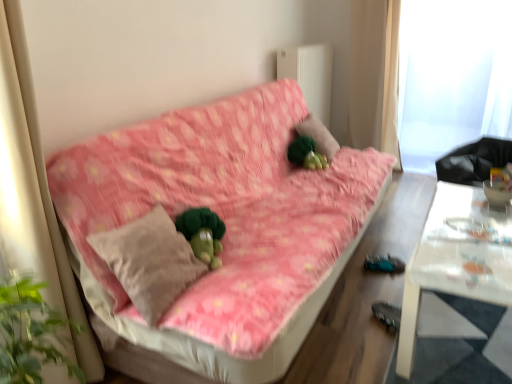
You are a GUI agent. You are given a task and a screenshot of the screen. Output one action in this format:
    pyautogui.click(x=<x>, y=<y>)
    Task: Click on the white glossy table at right
    
    Given the screenshot: What is the action you would take?
    pyautogui.click(x=457, y=258)

The image size is (512, 384). What do you see at coordinates (306, 154) in the screenshot? I see `green plush toy at center` at bounding box center [306, 154].

Describe the element at coordinates (319, 135) in the screenshot. The height and width of the screenshot is (384, 512). I see `green plush at center` at that location.

Where is `beige fabric pillow at center`? This screenshot has height=384, width=512. beige fabric pillow at center is located at coordinates (149, 261).

Find the location of a particular element. white glossy table at right is located at coordinates (457, 258).

Between pink floral fabric couch at center and white fabric curtain at upper right, which one has larger size?

pink floral fabric couch at center.

What's the angular difference between pink floral fabric couch at center and white fabric curtain at upper right's facing directions?

90 degrees separate the facing orientations of pink floral fabric couch at center and white fabric curtain at upper right.

Is pink floral fabric couch at center wider or thinner than white fabric curtain at upper right?

In the image, pink floral fabric couch at center appears to be wider than white fabric curtain at upper right.

Consider the image. Can we say pink floral fabric couch at center lies outside white fabric curtain at upper right?

pink floral fabric couch at center lies outside white fabric curtain at upper right's area.

Considering the relative sizes of green plush at center and white fabric curtain at upper right in the image provided, is green plush at center thinner than white fabric curtain at upper right?

Correct, the width of green plush at center is less than that of white fabric curtain at upper right.

In the scene shown: Would you say green plush at center is a long distance from white fabric curtain at upper right?

They are positioned close to each other.

Between green plush at center and white fabric curtain at upper right, which one has larger size?

Bigger between the two is white fabric curtain at upper right.

Is point (321, 191) closer or farther from the camera than point (316, 140)?

Point (321, 191).

Is green plush at center located within pink floral fabric couch at center?

Indeed, green plush at center is located within pink floral fabric couch at center.

Who is shorter, pink floral fabric couch at center or green plush at center?

With less height is green plush at center.

From the image's perspective, does pink floral fabric couch at center appear higher than green plush at center?

No, from the image's perspective, pink floral fabric couch at center is not on top of green plush at center.

Can you confirm if white glossy table at right is positioned to the right of beige fabric pillow at center?

Yes, white glossy table at right is to the right of beige fabric pillow at center.

From the image's perspective, would you say white glossy table at right is positioned over beige fabric pillow at center?

No.

What's the angular difference between white glossy table at right and beige fabric pillow at center's facing directions?

The angular difference between white glossy table at right and beige fabric pillow at center is 90 degrees.

Are white glossy table at right and beige fabric pillow at center making contact?

There is a gap between white glossy table at right and beige fabric pillow at center.

Is green plush at center positioned with its back to transparent plastic window screen at upper right?

That's not correct — green plush at center is not looking away from transparent plastic window screen at upper right.

From the image's perspective, is green plush at center above transparent plastic window screen at upper right?

No.

Considering the relative sizes of green plush at center and transparent plastic window screen at upper right in the image provided, is green plush at center smaller than transparent plastic window screen at upper right?

Correct, green plush at center occupies less space than transparent plastic window screen at upper right.

Considering the positions of objects green plush at center and transparent plastic window screen at upper right in the image provided, who is more to the right, green plush at center or transparent plastic window screen at upper right?

Positioned to the right is transparent plastic window screen at upper right.

Is green plush toy at center completely or partially inside white fabric curtain at upper right?

That's incorrect, green plush toy at center is not inside white fabric curtain at upper right.

Locate an element on the screen. This screenshot has height=384, width=512. toy in front of the white fabric curtain at upper right is located at coordinates (306, 154).

Which object is positioned more to the left, white fabric curtain at upper right or green plush toy at center?

green plush toy at center is more to the left.

Considering the sizes of objects white glossy table at right and transparent plastic window screen at upper right in the image provided, who is taller, white glossy table at right or transparent plastic window screen at upper right?

With more height is transparent plastic window screen at upper right.

Is white glossy table at right not near transparent plastic window screen at upper right?

Yes.

Which of these two, white glossy table at right or transparent plastic window screen at upper right, is thinner?

With smaller width is transparent plastic window screen at upper right.

Is point (473, 246) positioned behind point (406, 41)?

No, (473, 246) is closer to viewer.

Identify the location of curtain above the pink floral fabric couch at center (from the image's perspective). The height and width of the screenshot is (384, 512). (375, 75).

Where is `curtain to the right of green plush at center`? This screenshot has width=512, height=384. curtain to the right of green plush at center is located at coordinates (375, 75).

Considering their positions, is white glossy table at right positioned further to pink floral fabric couch at center than transparent plastic window screen at upper right?

The object further to pink floral fabric couch at center is transparent plastic window screen at upper right.

Looking at the image, which one is located further to white fabric curtain at upper right, transparent plastic window screen at upper right or pink floral fabric couch at center?

The object further to white fabric curtain at upper right is pink floral fabric couch at center.

Estimate the real-world distances between objects in this image. Which object is closer to white fabric curtain at upper right, white glossy table at right or green plush toy at center?

green plush toy at center is closer to white fabric curtain at upper right.

Looking at the image, which one is located closer to green plush at center, transparent plastic window screen at upper right or white fabric curtain at upper right?

The object closer to green plush at center is white fabric curtain at upper right.

Which object lies nearer to the anchor point white fabric curtain at upper right, beige fabric pillow at center or white glossy table at right?

Among the two, white glossy table at right is located nearer to white fabric curtain at upper right.

When comparing their distances from transparent plastic window screen at upper right, does pink floral fabric couch at center or white glossy table at right seem closer?

The object closer to transparent plastic window screen at upper right is pink floral fabric couch at center.

From the picture: Which object lies nearer to the anchor point white fabric curtain at upper right, beige fabric pillow at center or pink floral fabric couch at center?

Among the two, pink floral fabric couch at center is located nearer to white fabric curtain at upper right.

Considering their positions, is pink floral fabric couch at center positioned further to green plush at center than beige fabric pillow at center?

beige fabric pillow at center.

Locate an element on the screen. The height and width of the screenshot is (384, 512). pillow between pink floral fabric couch at center and transparent plastic window screen at upper right in the front-back direction is located at coordinates (319, 135).

The width and height of the screenshot is (512, 384). I want to click on table between pink floral fabric couch at center and green plush at center along the z-axis, so click(x=457, y=258).

Find the location of a particular element. This screenshot has width=512, height=384. table situated between beige fabric pillow at center and transparent plastic window screen at upper right from left to right is located at coordinates (457, 258).

Locate an element on the screen. The width and height of the screenshot is (512, 384). window screen between pink floral fabric couch at center and white fabric curtain at upper right from front to back is located at coordinates (452, 77).